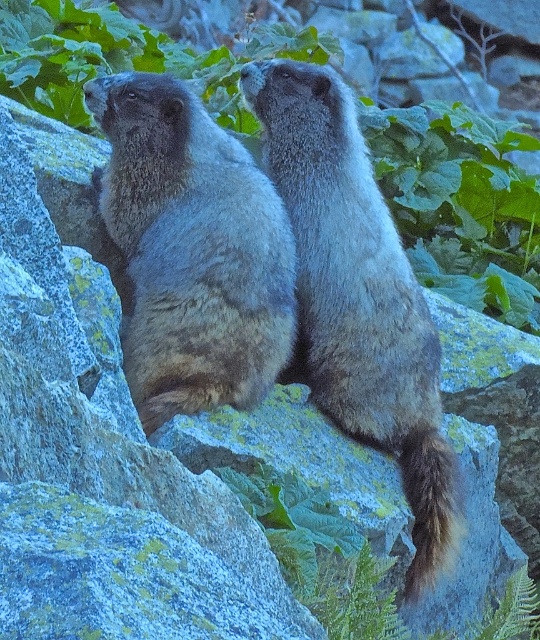
Question: Which object is closer to the camera taking this photo?

Choices:
 (A) green leafy plant at upper center
 (B) fuzzy brownish-gray marmot at center

Answer: (B)

Question: Estimate the real-world distances between objects in this image. Which object is farther from the brown furry tail at right?

Choices:
 (A) fuzzy brownish-gray marmot at center
 (B) fuzzy brown groundhog at center
 (C) green leafy plant at upper center

Answer: (C)

Question: Does fuzzy brownish-gray marmot at center have a lesser width compared to brown furry tail at right?

Choices:
 (A) no
 (B) yes

Answer: (A)

Question: Is fuzzy brown groundhog at center bigger than green leafy plant at upper center?

Choices:
 (A) yes
 (B) no

Answer: (B)

Question: Does fuzzy brownish-gray marmot at center lie in front of green leafy plant at upper center?

Choices:
 (A) yes
 (B) no

Answer: (A)

Question: Which object is farther from the camera taking this photo?

Choices:
 (A) brown furry tail at right
 (B) green leafy plant at upper center
 (C) fuzzy brownish-gray marmot at center
 (D) fuzzy brown groundhog at center

Answer: (B)